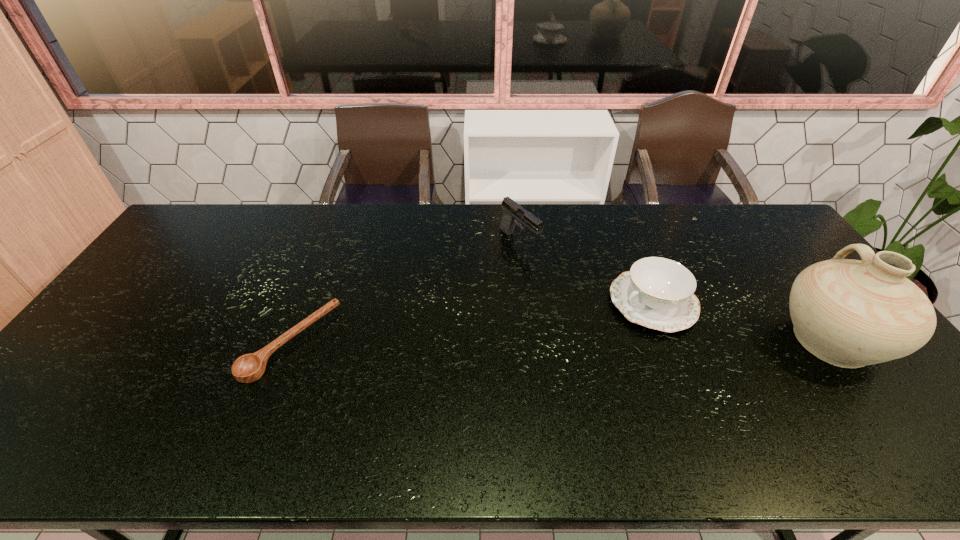
Locate an element on the screen. This screenshot has height=540, width=960. vacant spot on the desktop that is between the leftmost object and the rightmost object and is positioned on the handle side of the chinaware is located at coordinates click(579, 341).

The width and height of the screenshot is (960, 540). I want to click on vacant spot on the desktop that is between the shortest object and the tallest object and is positioned aim along the barrel of the pistol, so click(x=642, y=341).